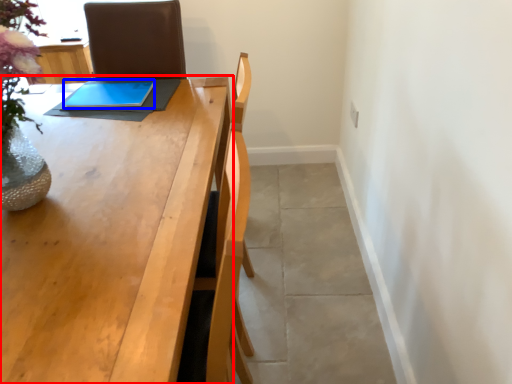
Question: Which point is further to the camera, table (highlighted by a red box) or tablet computer (highlighted by a blue box)?

Choices:
 (A) table
 (B) tablet computer

Answer: (B)